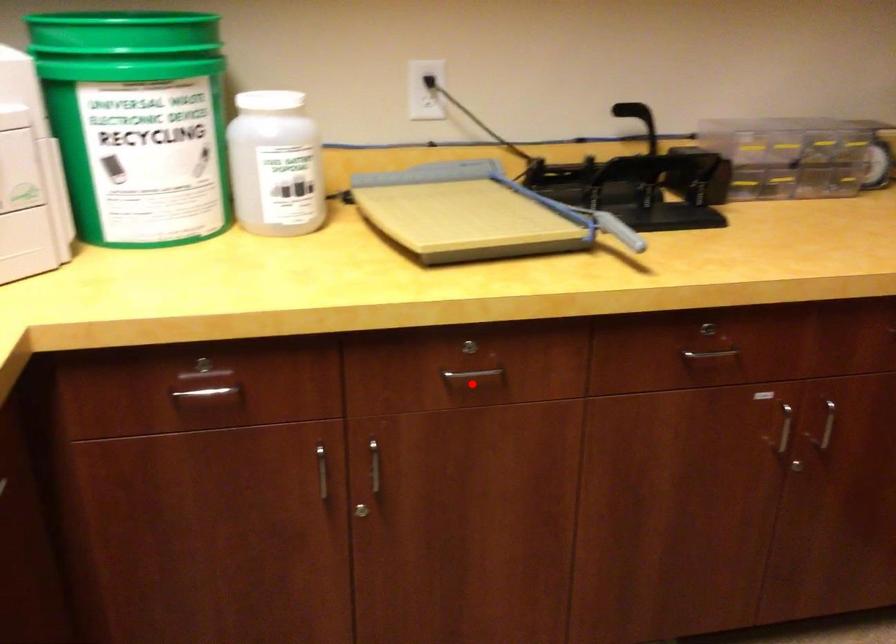
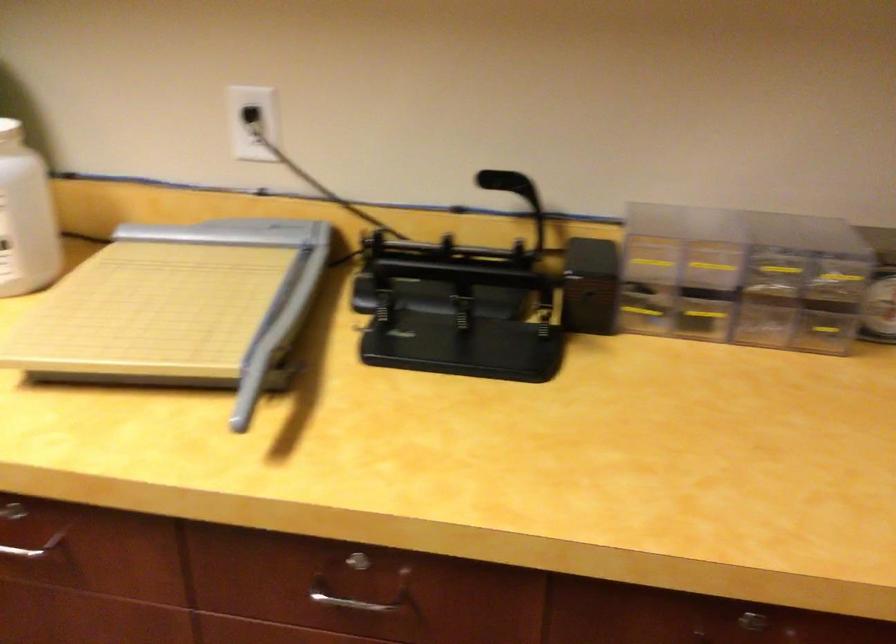
Where in the second image is the point corresponding to the highlighted location from the first image?

(33, 547)